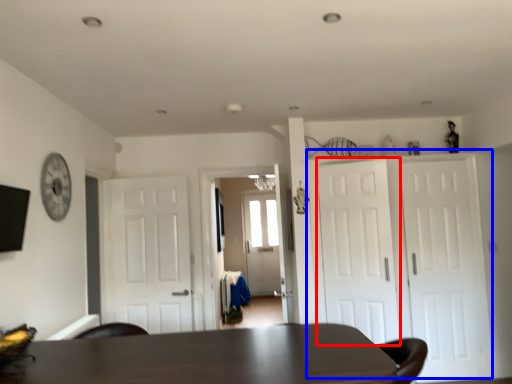
Question: Which object is closer to the camera taking this photo, door (highlighted by a red box) or door (highlighted by a blue box)?

Choices:
 (A) door
 (B) door

Answer: (A)